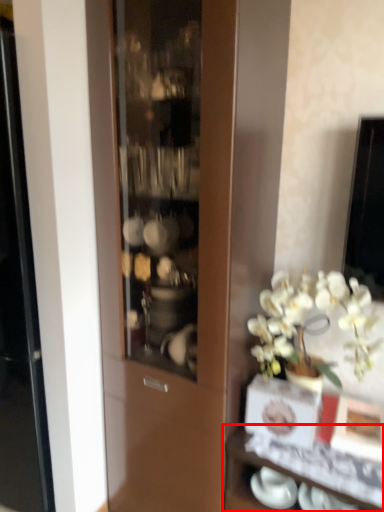
Question: From the image's perspective, considering the relative positions of shelf (annotated by the red box) and tableware in the image provided, where is shelf (annotated by the red box) located with respect to the staircase?

Choices:
 (A) below
 (B) above

Answer: (A)